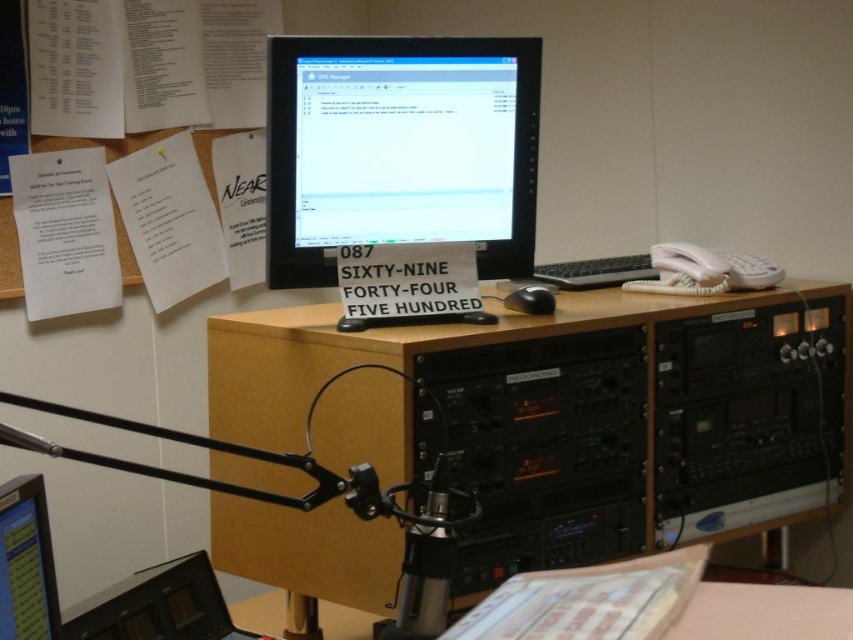
You are an assistant organizing the desk. You need to place a new keyboard that will be positioned at point 0.9, 0.05. Will the new keyboard interfere with the black glossy monitor at lower left?

The black glossy monitor at lower left is located at point [26,563]. The new keyboard is at [42,576]. Since the coordinates are close, there might be some interference depending on the size of the monitor and keyboard. However, based on the given points, the keyboard is slightly to the right and above the monitor, so it might not directly overlap but could be in close proximity.

You are standing 1.5 meters away from the desk in the radio station workspace. There is a point marked at coordinates point (294, 584). Can you reach this point without moving closer to the desk?

The point (294, 584) is 1.36 meters away from the viewer. Since you are currently 1.5 meters away from the desk, you are slightly farther than the point. To reach it, you would need to move 0.14 meters closer to the desk.

You are organizing a small event and need to place a 1.2 meter long banner on the desk. Given the black plastic computer desk at center and the black matte mouse at center, can you determine if the banner will fit on the desk?

The black plastic computer desk at center has a width larger than the black matte mouse at center. However, the exact dimensions of the desk are not provided. The banner is 1.2 meters long, but without knowing the desk length, we cannot confirm if it will fit. Please check the desk dimensions first.